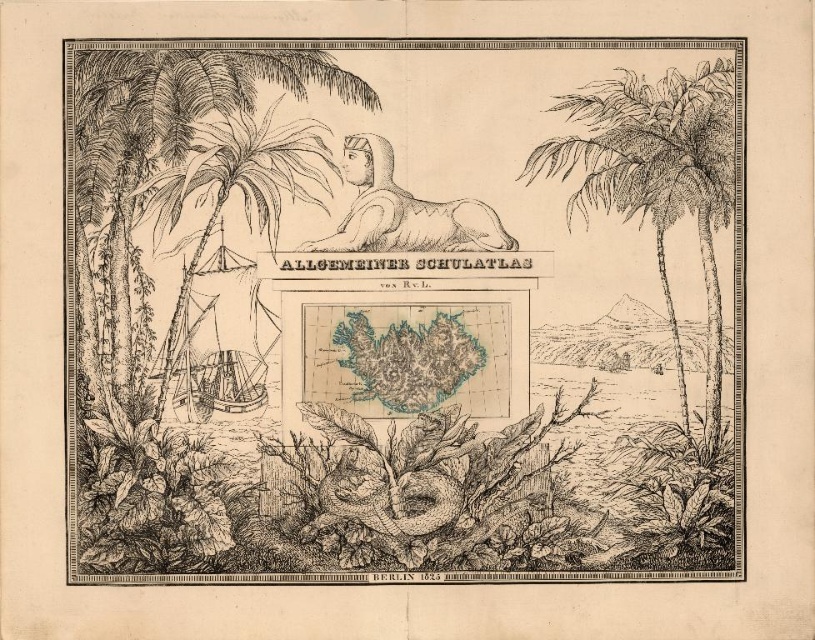
Question: Which of the following is the farthest from the observer?

Choices:
 (A) (98, 220)
 (B) (386, 154)

Answer: (A)

Question: Can you confirm if blue ink map at center is thinner than smooth beige statue at center?

Choices:
 (A) no
 (B) yes

Answer: (A)

Question: Which is farther from the blue ink map at center?

Choices:
 (A) smooth beige statue at center
 (B) black ink palm tree at right

Answer: (B)

Question: Can you confirm if blue ink map at center is wider than smooth beige statue at center?

Choices:
 (A) no
 (B) yes

Answer: (B)

Question: Based on their relative distances, which object is nearer to the blue ink map at center?

Choices:
 (A) black ink palm tree at right
 (B) smooth beige statue at center

Answer: (B)

Question: Is blue ink map at center thinner than smooth beige statue at center?

Choices:
 (A) no
 (B) yes

Answer: (A)